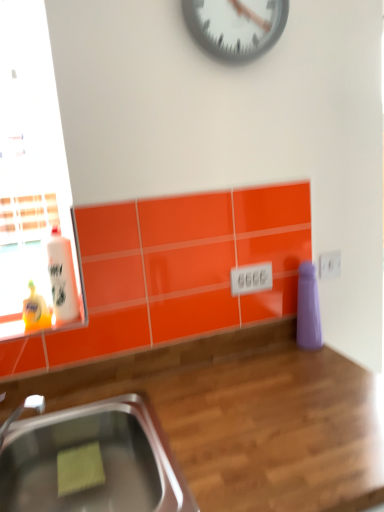
Question: Does stainless steel sink at lower left have a smaller size compared to metallic gray clock at upper center?

Choices:
 (A) no
 (B) yes

Answer: (A)

Question: Is stainless steel sink at lower left facing away from metallic gray clock at upper center?

Choices:
 (A) no
 (B) yes

Answer: (A)

Question: Is stainless steel sink at lower left in front of metallic gray clock at upper center?

Choices:
 (A) yes
 (B) no

Answer: (A)

Question: Is stainless steel sink at lower left behind metallic gray clock at upper center?

Choices:
 (A) yes
 (B) no

Answer: (B)

Question: Is stainless steel sink at lower left at the left side of metallic gray clock at upper center?

Choices:
 (A) no
 (B) yes

Answer: (B)

Question: Based on their positions, is stainless steel sink at lower left located to the left or right of wooden at lower right?

Choices:
 (A) left
 (B) right

Answer: (A)

Question: Is point (185, 487) closer or farther from the camera than point (278, 455)?

Choices:
 (A) closer
 (B) farther

Answer: (A)

Question: Is stainless steel sink at lower left taller or shorter than wooden at lower right?

Choices:
 (A) tall
 (B) short

Answer: (B)

Question: Looking at their shapes, would you say stainless steel sink at lower left is wider or thinner than wooden at lower right?

Choices:
 (A) wide
 (B) thin

Answer: (B)

Question: Relative to white glossy bottle at left, is metallic gray clock at upper center in front or behind?

Choices:
 (A) behind
 (B) front

Answer: (B)

Question: In terms of size, does metallic gray clock at upper center appear bigger or smaller than white glossy bottle at left?

Choices:
 (A) big
 (B) small

Answer: (A)

Question: From the image's perspective, is metallic gray clock at upper center positioned above or below white glossy bottle at left?

Choices:
 (A) below
 (B) above

Answer: (B)

Question: Visually, is metallic gray clock at upper center positioned to the left or to the right of white glossy bottle at left?

Choices:
 (A) right
 (B) left

Answer: (A)

Question: From a real-world perspective, is wooden at lower right physically located above or below stainless steel sink at lower left?

Choices:
 (A) below
 (B) above

Answer: (A)

Question: Looking at their shapes, would you say wooden at lower right is wider or thinner than stainless steel sink at lower left?

Choices:
 (A) wide
 (B) thin

Answer: (A)